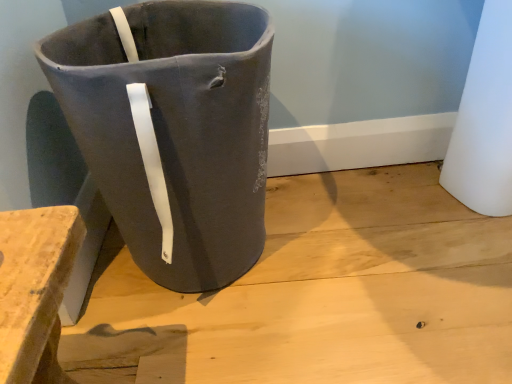
Where is `vacant area in front of matte gray fabric bag at center`? The height and width of the screenshot is (384, 512). vacant area in front of matte gray fabric bag at center is located at coordinates (207, 347).